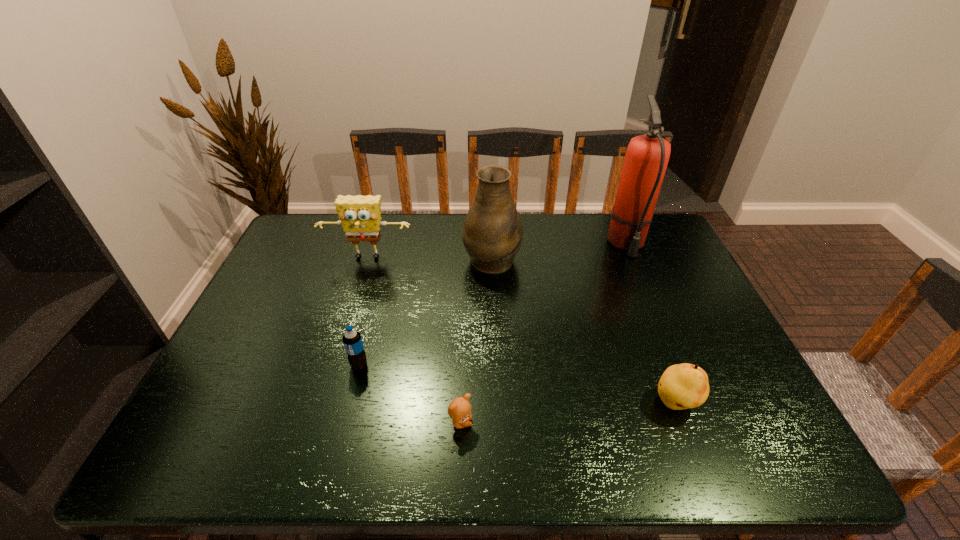
This screenshot has width=960, height=540. What are the coordinates of `the tallest object` in the screenshot? It's located at (646, 158).

Identify the location of pitcher. (492, 235).

I want to click on sponge, so click(x=359, y=215).

Image resolution: width=960 pixels, height=540 pixels. I want to click on the third nearest object, so click(352, 340).

Locate an element on the screen. The height and width of the screenshot is (540, 960). pear is located at coordinates (682, 386).

Where is `the shortest object`? The height and width of the screenshot is (540, 960). the shortest object is located at coordinates (459, 410).

What are the coordinates of `vacant area situated 0.210m on the nozzle of the fire extinguisher` in the screenshot? It's located at (655, 312).

The width and height of the screenshot is (960, 540). I want to click on free spot located on the handle side of the pitcher, so click(492, 229).

The height and width of the screenshot is (540, 960). Find the location of `free space located on the handle side of the pitcher`. free space located on the handle side of the pitcher is located at coordinates (491, 227).

This screenshot has height=540, width=960. What are the coordinates of `vacant area situated 0.300m on the face of the sponge` in the screenshot? It's located at (342, 341).